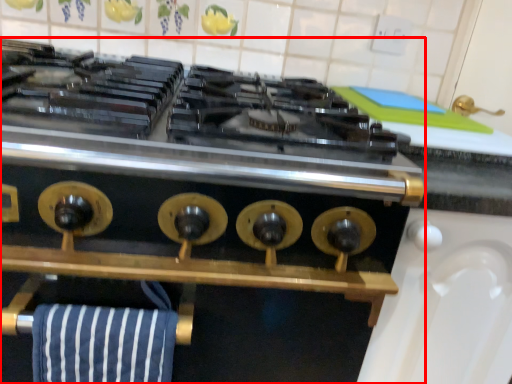
Question: Where is kitchen appliance (annotated by the red box) located in relation to beach towel in the image?

Choices:
 (A) left
 (B) right

Answer: (A)